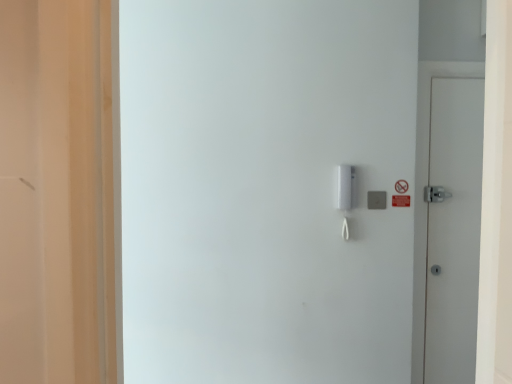
Question: Is gray matte/light switch at center-right shorter than white plastic intercom at center-right?

Choices:
 (A) no
 (B) yes

Answer: (B)

Question: Considering the relative positions of gray matte/light switch at center-right and white plastic intercom at center-right in the image provided, is gray matte/light switch at center-right to the right of white plastic intercom at center-right from the viewer's perspective?

Choices:
 (A) no
 (B) yes

Answer: (B)

Question: Considering the relative sizes of gray matte/light switch at center-right and white plastic intercom at center-right in the image provided, is gray matte/light switch at center-right taller than white plastic intercom at center-right?

Choices:
 (A) no
 (B) yes

Answer: (A)

Question: From a real-world perspective, is gray matte/light switch at center-right on white plastic intercom at center-right?

Choices:
 (A) no
 (B) yes

Answer: (A)

Question: Is gray matte/light switch at center-right positioned behind white plastic intercom at center-right?

Choices:
 (A) yes
 (B) no

Answer: (A)

Question: Which is correct: white matte door at right is inside gray matte/light switch at center-right, or outside of it?

Choices:
 (A) inside
 (B) outside

Answer: (B)

Question: Does point (467, 296) appear closer or farther from the camera than point (382, 193)?

Choices:
 (A) farther
 (B) closer

Answer: (A)

Question: Considering the positions of white matte door at right and gray matte/light switch at center-right in the image, is white matte door at right wider or thinner than gray matte/light switch at center-right?

Choices:
 (A) thin
 (B) wide

Answer: (B)

Question: Considering their positions, is white matte door at right located in front of or behind gray matte/light switch at center-right?

Choices:
 (A) behind
 (B) front

Answer: (A)

Question: Would you say gray matte/light switch at center-right is to the left or to the right of white matte door at right in the picture?

Choices:
 (A) left
 (B) right

Answer: (A)

Question: From a real-world perspective, is gray matte/light switch at center-right physically located above or below white matte door at right?

Choices:
 (A) below
 (B) above

Answer: (B)

Question: Does point (370, 198) appear closer or farther from the camera than point (436, 119)?

Choices:
 (A) closer
 (B) farther

Answer: (A)

Question: Considering the positions of gray matte/light switch at center-right and white matte door at right in the image, is gray matte/light switch at center-right taller or shorter than white matte door at right?

Choices:
 (A) tall
 (B) short

Answer: (B)

Question: Do you think white plastic intercom at center-right is within white matte door at right, or outside of it?

Choices:
 (A) inside
 (B) outside

Answer: (B)

Question: Is white plastic intercom at center-right in front of or behind white matte door at right in the image?

Choices:
 (A) front
 (B) behind

Answer: (A)